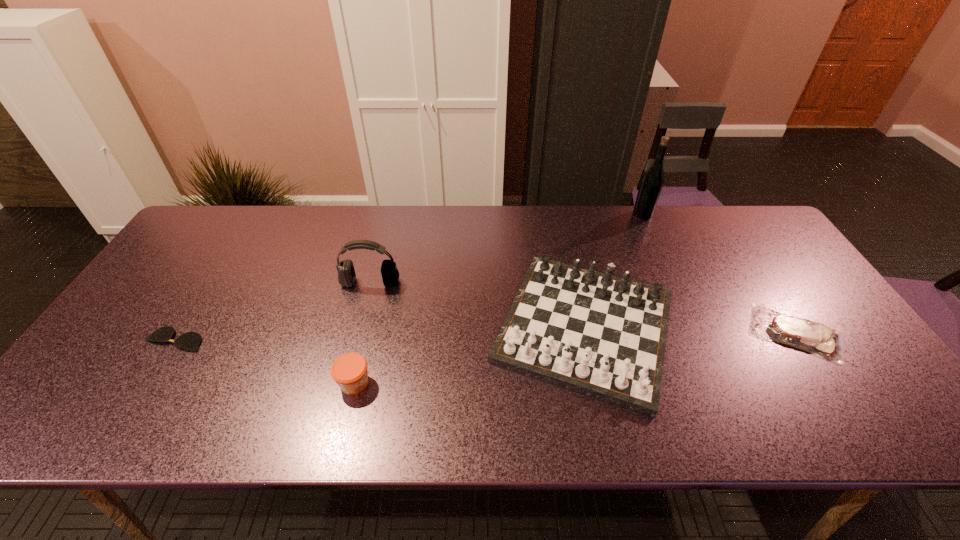
The image size is (960, 540). I want to click on free space at the near edge of the desktop, so click(185, 428).

Find the location of a particular element. The height and width of the screenshot is (540, 960). vacant area at the left edge of the desktop is located at coordinates (192, 307).

In the image, there is a desktop. Where is `vacant space at the right edge`? Image resolution: width=960 pixels, height=540 pixels. vacant space at the right edge is located at coordinates (872, 370).

In order to click on vacant space at the near left corner of the desktop in this screenshot , I will do `click(114, 429)`.

This screenshot has height=540, width=960. In the image, there is a desktop. Identify the location of vacant space at the near right corner. (896, 431).

At what (x,y) coordinates should I click in order to perform the action: click on vacant area that lies between the tallest object and the rightmost object. Please return your answer as a coordinate pair (x, y). Looking at the image, I should click on (719, 273).

The width and height of the screenshot is (960, 540). In order to click on free area in between the chessboard and the headset in this screenshot , I will do `click(478, 305)`.

Locate an element on the screen. empty space that is in between the chessboard and the jam is located at coordinates (469, 355).

Locate an element on the screen. This screenshot has height=540, width=960. empty location between the leftmost object and the rightmost object is located at coordinates (485, 336).

The image size is (960, 540). I want to click on unoccupied position between the fifth tallest object and the shortest object, so click(x=485, y=336).